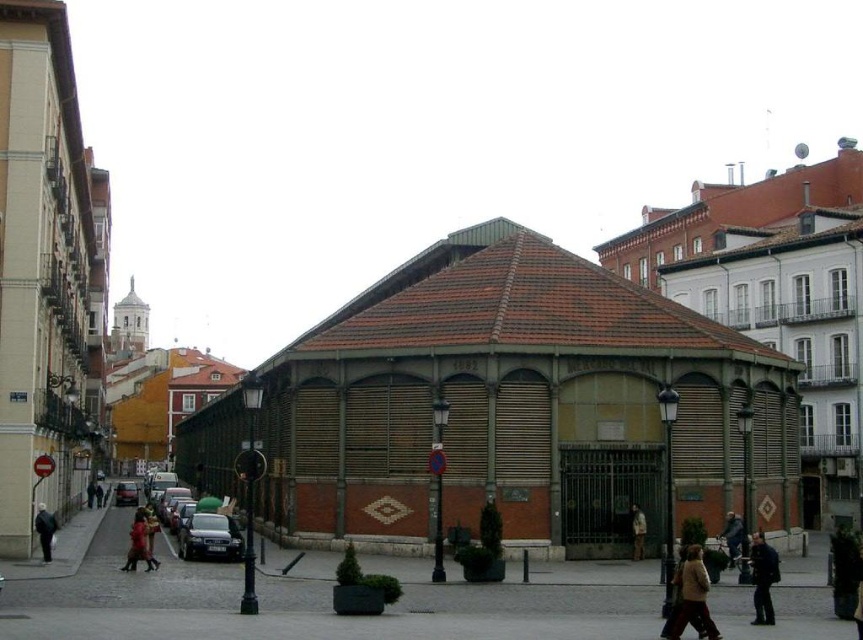
You are standing at the center of the street looking at the large octagonal building. There are two points marked on the ground in front of you. One is at coordinates point (133, 554) and the other is at point (728, 522). Which point is closer to your current position?

Point (133, 554) is closer to the camera than point (728, 522), so the point at coordinates point (133, 554) is closer to your current position.